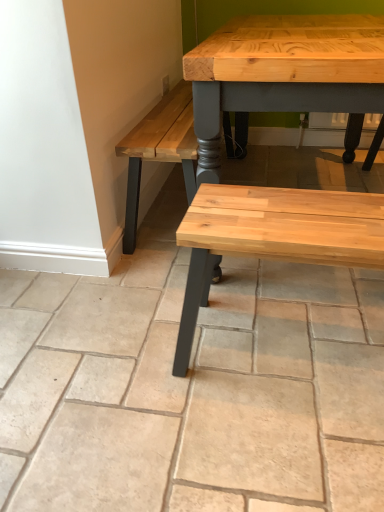
At what (x,y) coordinates should I click in order to perform the action: click on free location to the left of natural wood bench at center. Please return your answer as a coordinate pair (x, y). Looking at the image, I should click on (130, 364).